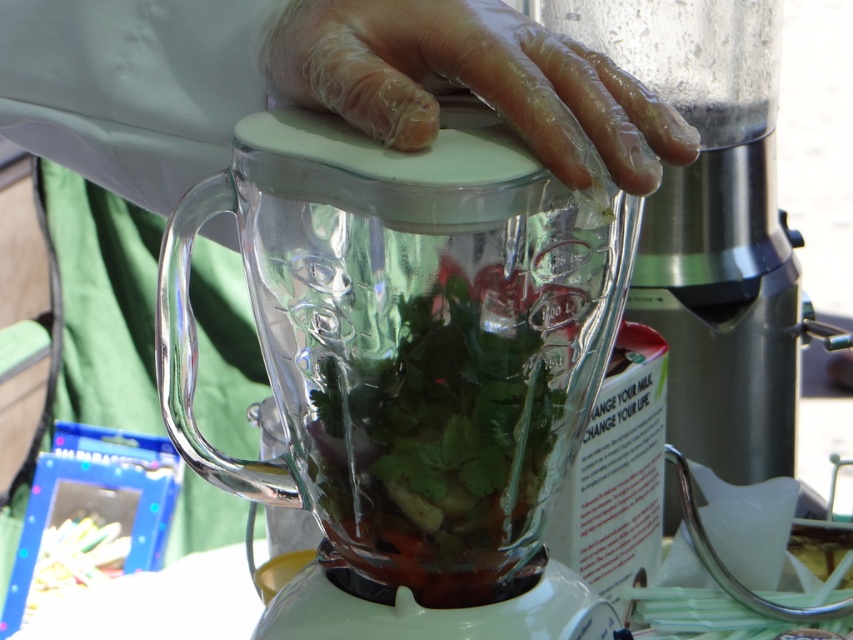
You are a food safety inspector checking the blender setup. The transparent glass food processor at center and the clear plastic glove at center are both in your line of sight. Which object is closer to you?

The transparent glass food processor at center is closer to you because it is further to the viewer than the clear plastic glove at center, meaning it appears nearer in your line of sight.

You are a food safety inspector checking a blender setup. The transparent glass blender at center and clear plastic glove at center are both in your line of sight. Which object is taller?

The transparent glass blender at center is taller than the clear plastic glove at center.

You are a food safety inspector checking the setup of a food stall. You see two appliances at the center of the counter, the transparent glass blender at center and the transparent glass food processor at center. Which one is closer to you?

The transparent glass blender at center is closer to the viewer than the transparent glass food processor at center.